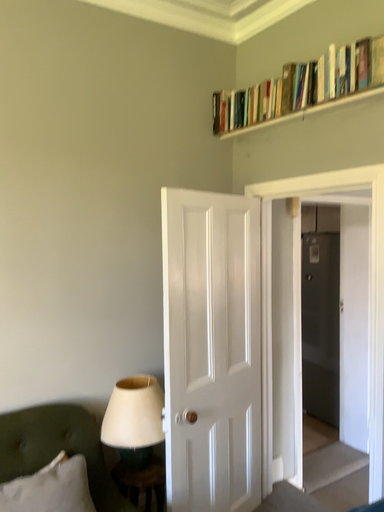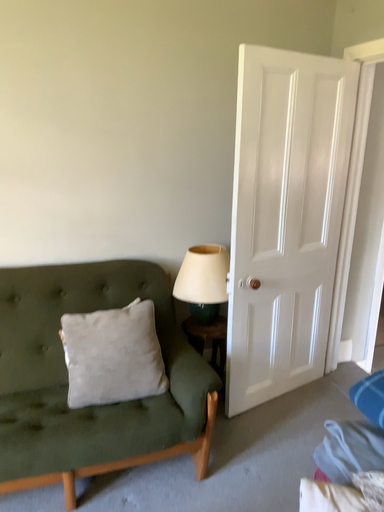
Question: Which way did the camera rotate in the video?

Choices:
 (A) rotated upward
 (B) rotated downward

Answer: (B)